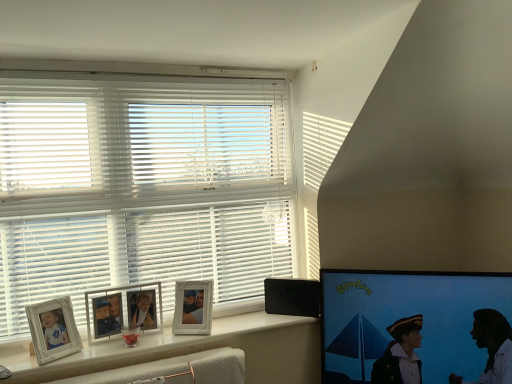
Question: Is white matte blinds at upper left bigger or smaller than white glossy window sill at lower left?

Choices:
 (A) big
 (B) small

Answer: (A)

Question: Is white matte blinds at upper left wider or thinner than white glossy window sill at lower left?

Choices:
 (A) thin
 (B) wide

Answer: (A)

Question: Which is nearer to the white glossy window sill at lower left?

Choices:
 (A) white glossy picture frame at upper center, which ranks as the 2th picture frame in left-to-right order
 (B) white wooden picture frame at lower left, the 1th picture frame viewed from the left
 (C) matte black screen at right
 (D) black plastic speaker at lower right
 (E) white matte blinds at upper left

Answer: (A)

Question: Estimate the real-world distances between objects in this image. Which object is farther from the white glossy picture frame at upper center, which appears as the first picture frame when viewed from the right?

Choices:
 (A) black plastic speaker at lower right
 (B) white wooden picture frame at lower left, acting as the second picture frame starting from the right
 (C) white matte blinds at upper left
 (D) matte black screen at right
 (E) white glossy window sill at lower left

Answer: (D)